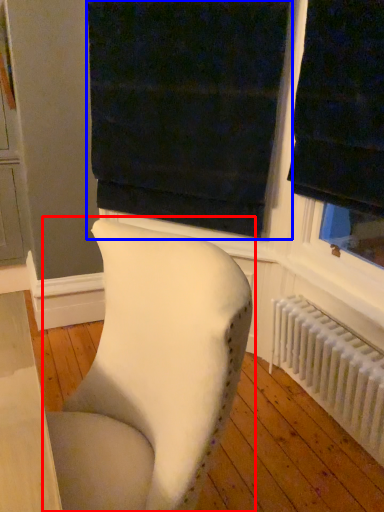
Question: Which point is closer to the camera, chair (highlighted by a red box) or curtain (highlighted by a blue box)?

Choices:
 (A) chair
 (B) curtain

Answer: (A)